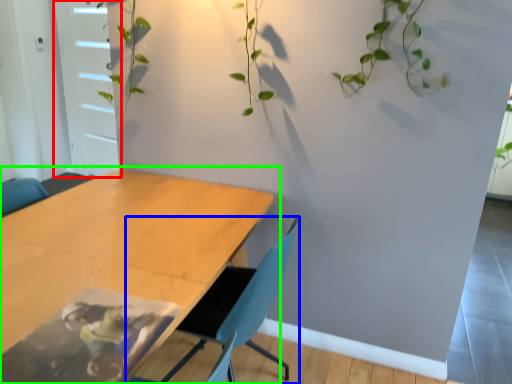
Question: Based on their relative distances, which object is farther from glass door (highlighted by a red box)? Choose from chair (highlighted by a blue box) and table (highlighted by a green box).

Choices:
 (A) chair
 (B) table

Answer: (A)